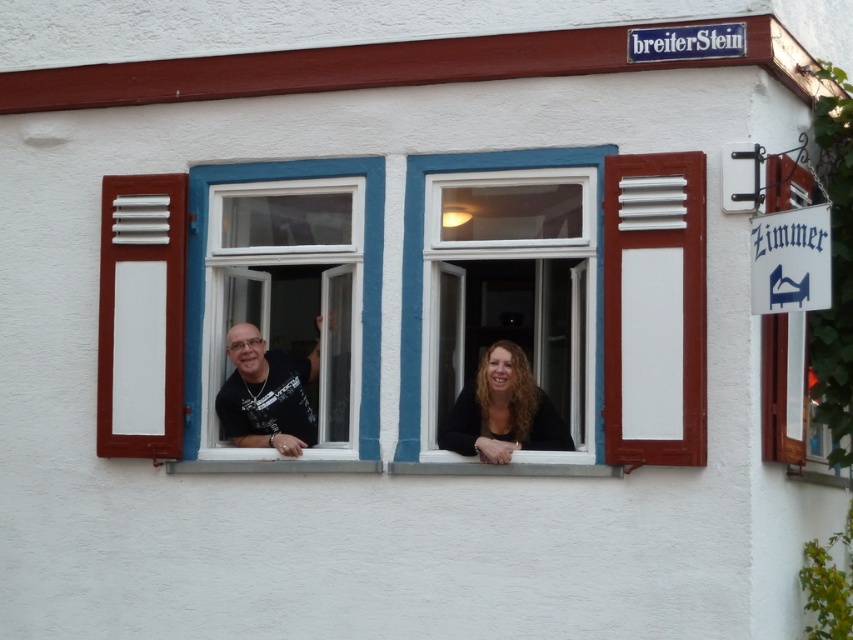
Question: Based on their relative distances, which object is farther from the white plastic window at center?

Choices:
 (A) white wooden window at center
 (B) dark brown hair at center

Answer: (B)

Question: Among these objects, which one is nearest to the camera?

Choices:
 (A) matte black shirt at center
 (B) black matte couple at center
 (C) white plastic window at center
 (D) white wooden window at center

Answer: (D)

Question: Is black matte couple at center in front of matte black shirt at center?

Choices:
 (A) no
 (B) yes

Answer: (A)

Question: Is black matte couple at center closer to the viewer compared to white plastic window at center?

Choices:
 (A) yes
 (B) no

Answer: (B)

Question: Observing the image, what is the correct spatial positioning of white wooden signboard at right in reference to dark brown hair at center?

Choices:
 (A) below
 (B) above

Answer: (B)

Question: Which of the following is the closest to the observer?

Choices:
 (A) dark brown hair at center
 (B) black matte couple at center

Answer: (A)